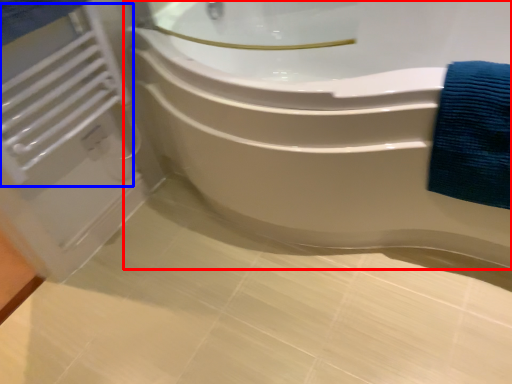
Question: Which of the following is the farthest to the observer, bathtub (highlighted by a red box) or radiator (highlighted by a blue box)?

Choices:
 (A) bathtub
 (B) radiator

Answer: (B)